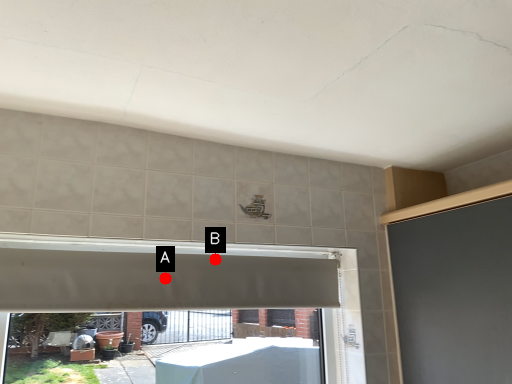
Question: Two points are circled on the image, labeled by A and B beside each circle. Which of the following is the farthest from the observer?

Choices:
 (A) A is further
 (B) B is further

Answer: (B)